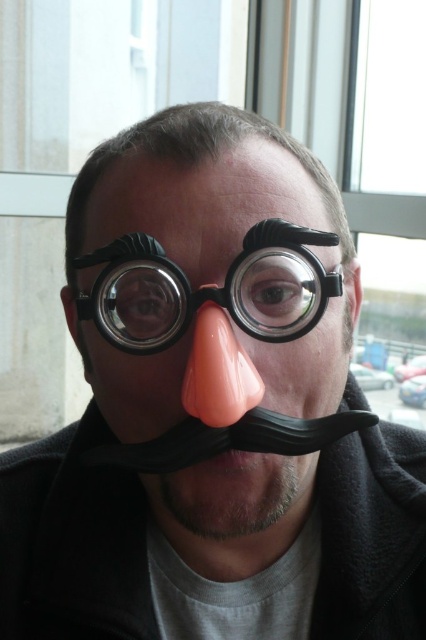
You are a photographer setting up a shot of a person wearing a clown costume. You need to adjust the lighting so that the pink rubber nose at center and the black rubber mustache at lower center are both clearly visible. Which accessory should you ensure is lit first to avoid shadows obscuring their positions?

The pink rubber nose at center is to the left of the black rubber mustache at lower center. Since the nose is positioned to the left, you should first ensure the lighting highlights the pink rubber nose at center to prevent shadows from the mustache overlapping and obscuring it.